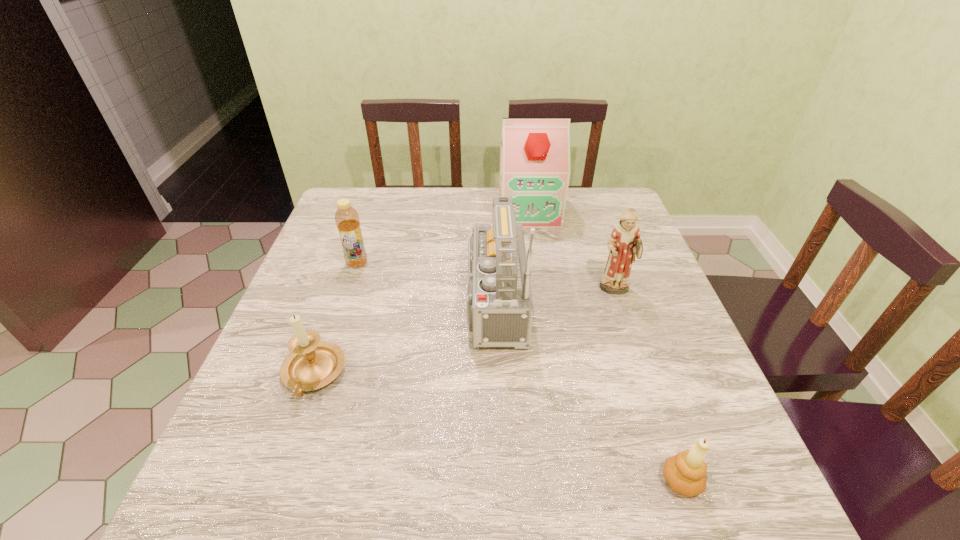
Locate an element on the screen. The height and width of the screenshot is (540, 960). free location located 0.310m on the front-facing side of the radio receiver is located at coordinates (316, 303).

The width and height of the screenshot is (960, 540). What are the coordinates of `vacant region located on the front-facing side of the radio receiver` in the screenshot? It's located at (x=380, y=303).

The width and height of the screenshot is (960, 540). I want to click on blank space located on the front-facing side of the fourth shortest object, so click(x=655, y=410).

Find the location of a particular element. free region located 0.190m on the right of the bottle is located at coordinates (441, 263).

The height and width of the screenshot is (540, 960). I want to click on vacant area situated with a handle on the side of the taller candle_holder, so click(x=274, y=488).

The image size is (960, 540). In order to click on blank space located on the left of the nearer candle_holder in this screenshot , I will do `click(490, 481)`.

Image resolution: width=960 pixels, height=540 pixels. What are the coordinates of `object at the far edge` in the screenshot? It's located at (535, 152).

Find the location of a particular element. The image size is (960, 540). object located in the near edge section of the desktop is located at coordinates (685, 472).

You are a GUI agent. You are given a task and a screenshot of the screen. Output one action in this format:
    pyautogui.click(x=<x>, y=<y>)
    Task: Click on the bottle present at the left edge
    
    Given the screenshot: What is the action you would take?
    pyautogui.click(x=347, y=220)

Identify the location of candle holder at the left edge. pyautogui.click(x=312, y=364).